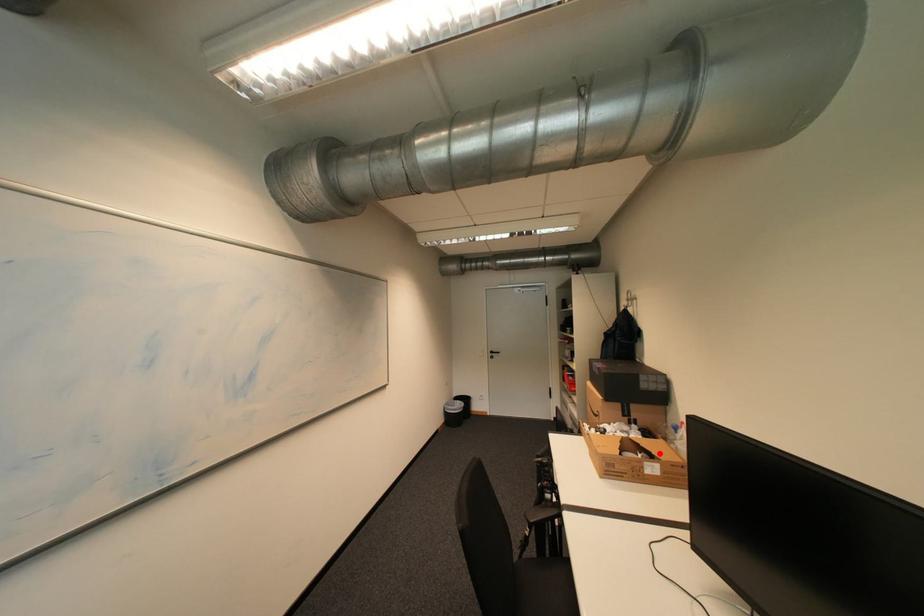
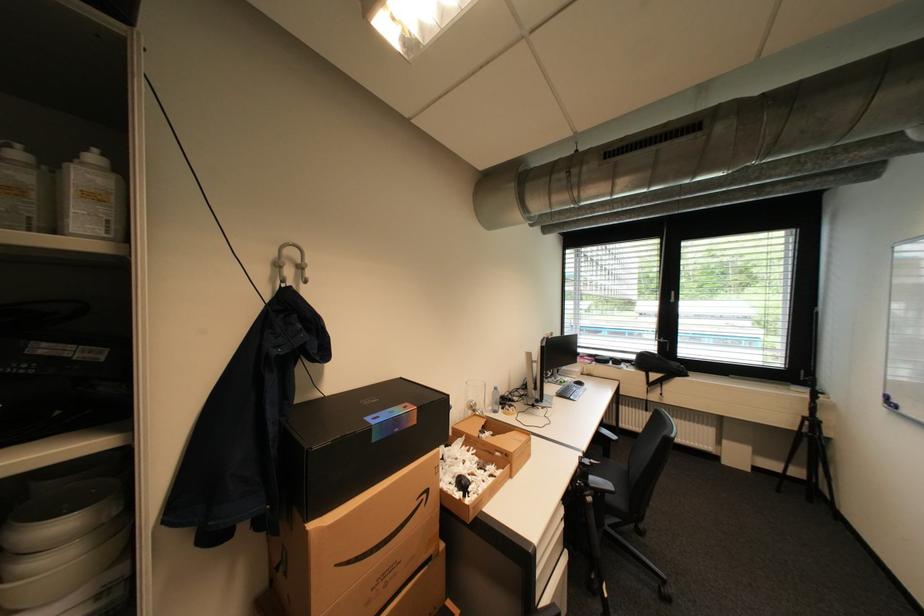
Where in the second image is the point corresponding to the highlighted location from the first image?

(492, 426)